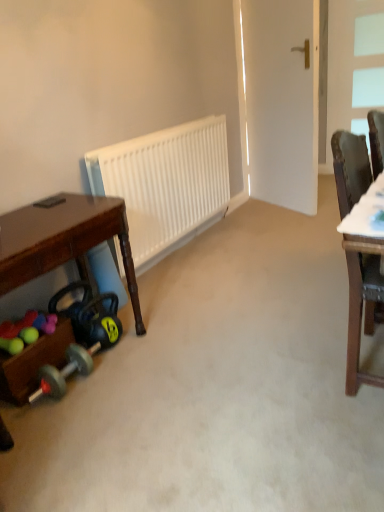
Question: Does rubberized plastic balls at lower left have a greater height compared to white matte radiator at center?

Choices:
 (A) no
 (B) yes

Answer: (A)

Question: Is the position of rubberized plastic balls at lower left more distant than that of white matte radiator at center?

Choices:
 (A) no
 (B) yes

Answer: (A)

Question: Can you confirm if rubberized plastic balls at lower left is bigger than white matte radiator at center?

Choices:
 (A) yes
 (B) no

Answer: (B)

Question: Is rubberized plastic balls at lower left beside white matte radiator at center?

Choices:
 (A) no
 (B) yes

Answer: (A)

Question: From the image's perspective, is rubberized plastic balls at lower left below white matte radiator at center?

Choices:
 (A) yes
 (B) no

Answer: (A)

Question: Is rubberized plastic balls at lower left positioned before white matte radiator at center?

Choices:
 (A) no
 (B) yes

Answer: (B)

Question: Is white matte radiator at center looking in the opposite direction of white glass window at upper right?

Choices:
 (A) no
 (B) yes

Answer: (A)

Question: Is white matte radiator at center smaller than white glass window at upper right?

Choices:
 (A) no
 (B) yes

Answer: (A)

Question: Does white matte radiator at center have a lesser height compared to white glass window at upper right?

Choices:
 (A) yes
 (B) no

Answer: (A)

Question: From a real-world perspective, is white matte radiator at center positioned under white glass window at upper right based on gravity?

Choices:
 (A) no
 (B) yes

Answer: (B)

Question: Would you say white matte radiator at center is a long distance from white glass window at upper right?

Choices:
 (A) yes
 (B) no

Answer: (A)

Question: Is white matte radiator at center outside of white glass window at upper right?

Choices:
 (A) yes
 (B) no

Answer: (A)

Question: From the image's perspective, would you say white glass window at upper right is shown under wooden toy box at lower left?

Choices:
 (A) no
 (B) yes

Answer: (A)